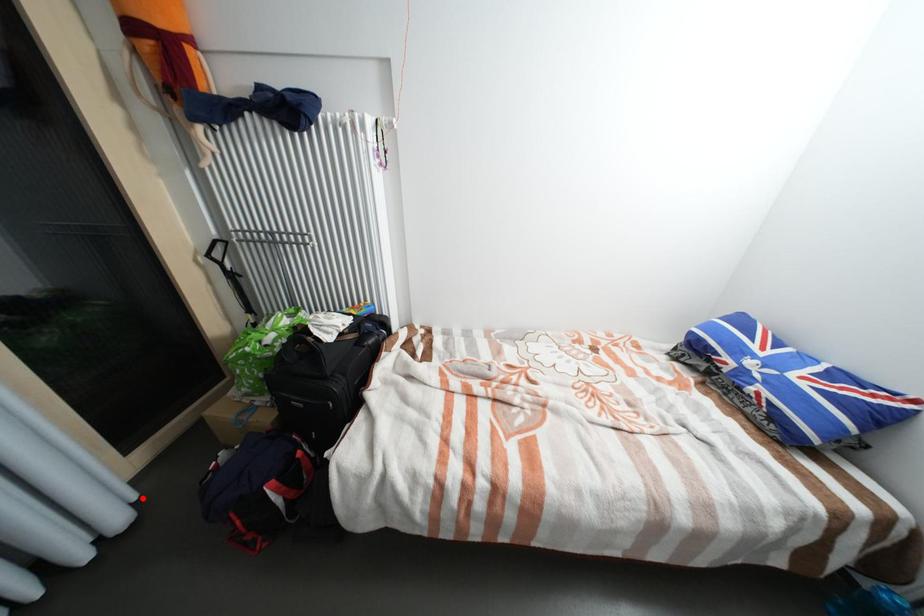
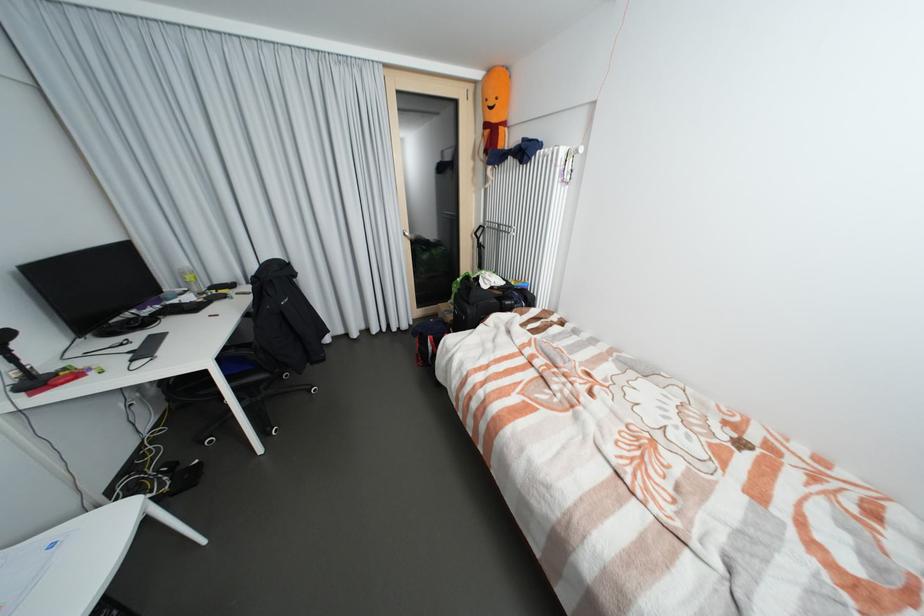
Locate, in the second image, the point that corresponds to the highlighted location in the first image.

(418, 323)